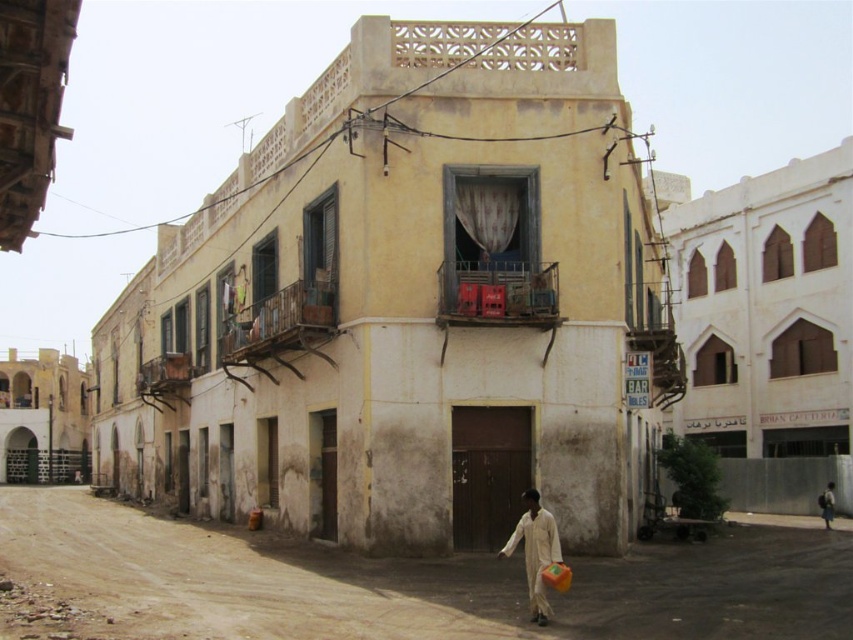
You are a delivery person trying to navigate through the street scene. You need to pass through either the dull concrete alley at lower left or the white cotton person at lower right. Which path allows you to move more freely?

The dull concrete alley at lower left is bigger than the white cotton person at lower right, so you can move more freely through the dull concrete alley at lower left.

You are a delivery person trying to navigate through the street scene. You need to pass through the narrowest path between the dull concrete alley at lower left and the white cotton person at lower right. Which path should you choose?

The white cotton person at lower right has a narrower width than the dull concrete alley at lower left, so you should choose the path next to the white cotton person at lower right to navigate through the narrowest path.